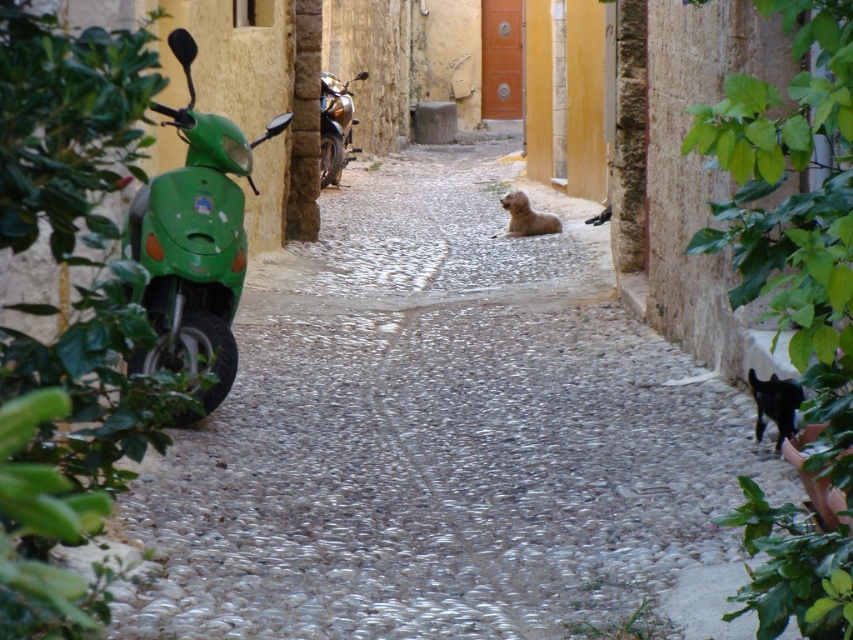
You are a delivery person with a package that needs to be placed between the metallic gold motorcycle at center and the black glossy cat at lower right. Considering their sizes, which object should you place the package closer to to ensure it doesn

The metallic gold motorcycle at center is bigger than the black glossy cat at lower right. Therefore, the package should be placed closer to the metallic gold motorcycle at center to ensure it can accommodate the space needed.

You are standing at the entrance of the narrow cobblestone alleyway and see two points marked in the scene. The first point is at coordinates point [321,168] and the second is at point [792,410]. Which point is closer to you?

Point [321,168] is further to the viewer than point [792,410], so the closer point to you is point [321,168].

You are a delivery person who needs to pass through the narrow cobblestone alleyway. You see a metallic gold motorcycle at center and a brown furry dog at center. Which object is positioned higher from the ground?

The metallic gold motorcycle at center is above the brown furry dog at center, so the metallic gold motorcycle at center is positioned higher from the ground.